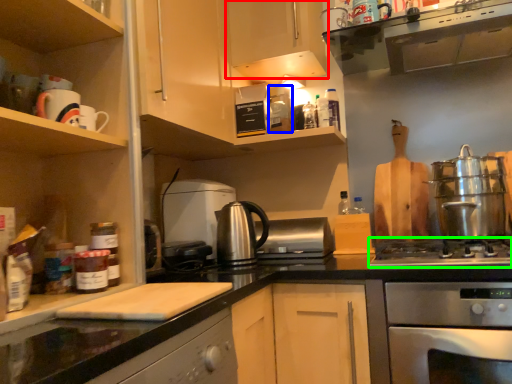
Question: Based on their relative distances, which object is nearer to cabinetry (highlighted by a red box)? Choose from appliance (highlighted by a blue box) and gas stove (highlighted by a green box).

Choices:
 (A) appliance
 (B) gas stove

Answer: (A)